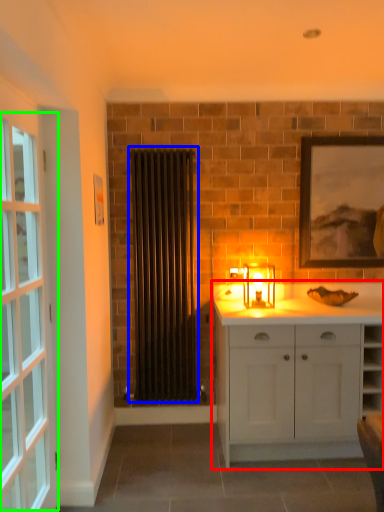
Question: Which is nearer to the cabinetry (highlighted by a red box)? curtain (highlighted by a blue box) or window (highlighted by a green box).

Choices:
 (A) curtain
 (B) window

Answer: (A)